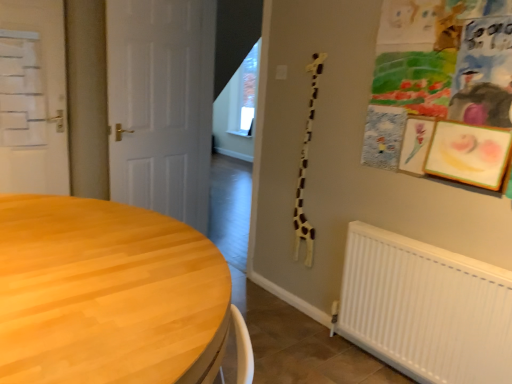
Question: Are wooden table at lower left and white matte door at left, which ranks as the 2th door in right-to-left order, beside each other?

Choices:
 (A) no
 (B) yes

Answer: (A)

Question: Considering the relative sizes of wooden table at lower left and white matte door at left, which ranks as the first door in left-to-right order, in the image provided, is wooden table at lower left taller than white matte door at left, which ranks as the first door in left-to-right order,?

Choices:
 (A) no
 (B) yes

Answer: (A)

Question: Is wooden table at lower left far away from white matte door at left, which ranks as the first door in left-to-right order?

Choices:
 (A) yes
 (B) no

Answer: (A)

Question: Considering the relative positions of wooden table at lower left and white matte door at left, which ranks as the 2th door in right-to-left order, in the image provided, is wooden table at lower left to the left of white matte door at left, which ranks as the 2th door in right-to-left order, from the viewer's perspective?

Choices:
 (A) yes
 (B) no

Answer: (B)

Question: Is wooden table at lower left to the right of white matte door at left, which ranks as the 2th door in right-to-left order, from the viewer's perspective?

Choices:
 (A) no
 (B) yes

Answer: (B)

Question: Choose the correct answer: Is white matte door at left, which ranks as the 2th door in right-to-left order, inside white matte door at center, the 2th door viewed from the left, or outside it?

Choices:
 (A) inside
 (B) outside

Answer: (B)

Question: Considering the positions of white matte door at left, which ranks as the 2th door in right-to-left order, and white matte door at center, the 2th door viewed from the left, in the image, is white matte door at left, which ranks as the 2th door in right-to-left order, taller or shorter than white matte door at center, the 2th door viewed from the left,?

Choices:
 (A) tall
 (B) short

Answer: (B)

Question: Does point (47, 163) appear closer or farther from the camera than point (160, 208)?

Choices:
 (A) farther
 (B) closer

Answer: (B)

Question: From the image's perspective, is white matte door at left, which ranks as the first door in left-to-right order, located above or below white matte door at center, the 2th door viewed from the left?

Choices:
 (A) above
 (B) below

Answer: (A)

Question: Is white matte door at left, which ranks as the first door in left-to-right order, spatially inside wooden table at lower left, or outside of it?

Choices:
 (A) outside
 (B) inside

Answer: (A)

Question: In terms of height, does white matte door at left, which ranks as the first door in left-to-right order, look taller or shorter compared to wooden table at lower left?

Choices:
 (A) short
 (B) tall

Answer: (B)

Question: Looking at their shapes, would you say white matte door at left, which ranks as the first door in left-to-right order, is wider or thinner than wooden table at lower left?

Choices:
 (A) wide
 (B) thin

Answer: (B)

Question: From a real-world perspective, relative to wooden table at lower left, is white matte door at left, which ranks as the first door in left-to-right order, vertically above or below?

Choices:
 (A) below
 (B) above

Answer: (B)

Question: Considering the positions of wooden table at lower left and white matte door at center, marked as the 1th door in a right-to-left arrangement, in the image, is wooden table at lower left taller or shorter than white matte door at center, marked as the 1th door in a right-to-left arrangement,?

Choices:
 (A) tall
 (B) short

Answer: (B)

Question: Which is correct: wooden table at lower left is inside white matte door at center, the 2th door viewed from the left, or outside of it?

Choices:
 (A) inside
 (B) outside

Answer: (B)